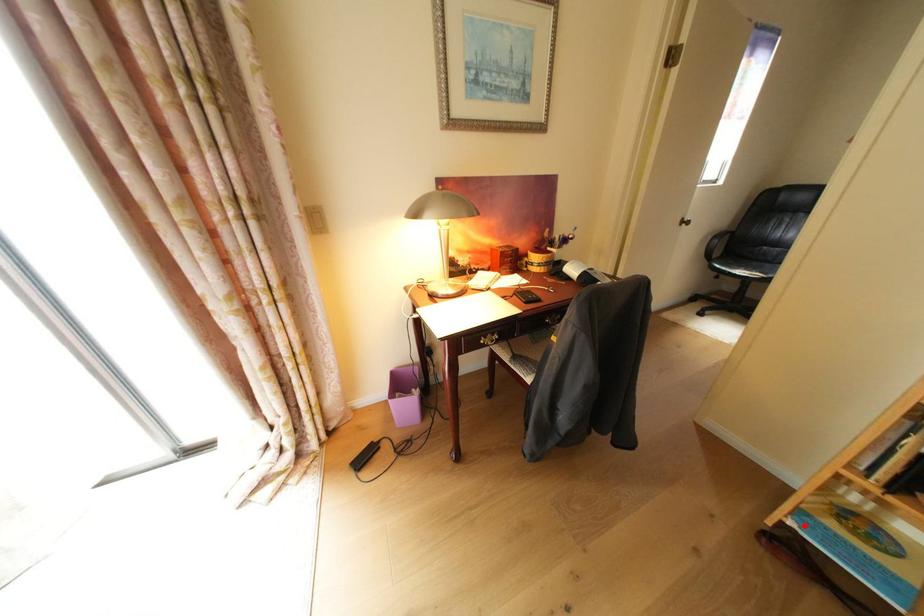
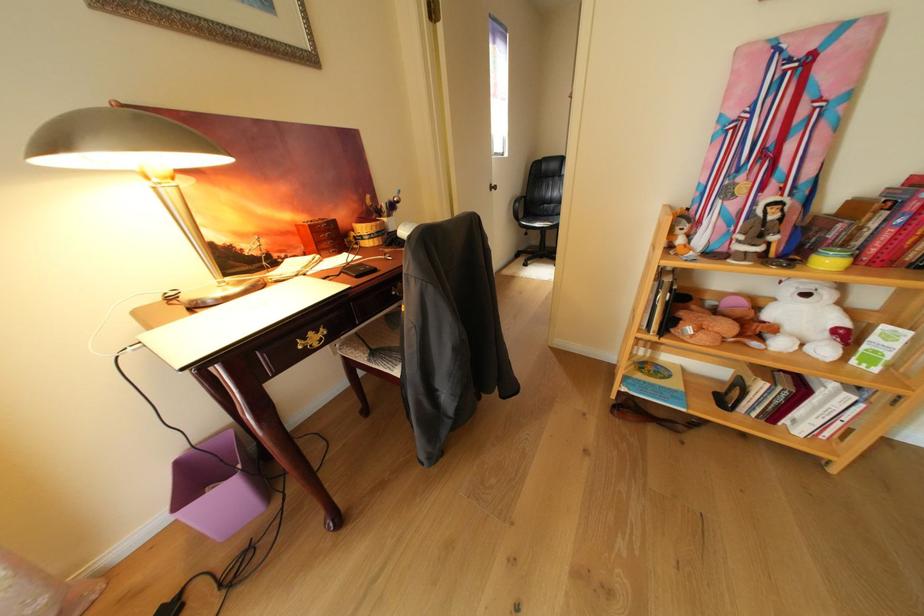
Question: I am providing you with two images of the same scene from different viewpoints. Given a red point in image1, look at the same physical point in image2. Is it:

Choices:
 (A) Closer to the viewpoint
 (B) Farther from the viewpoint

Answer: (A)